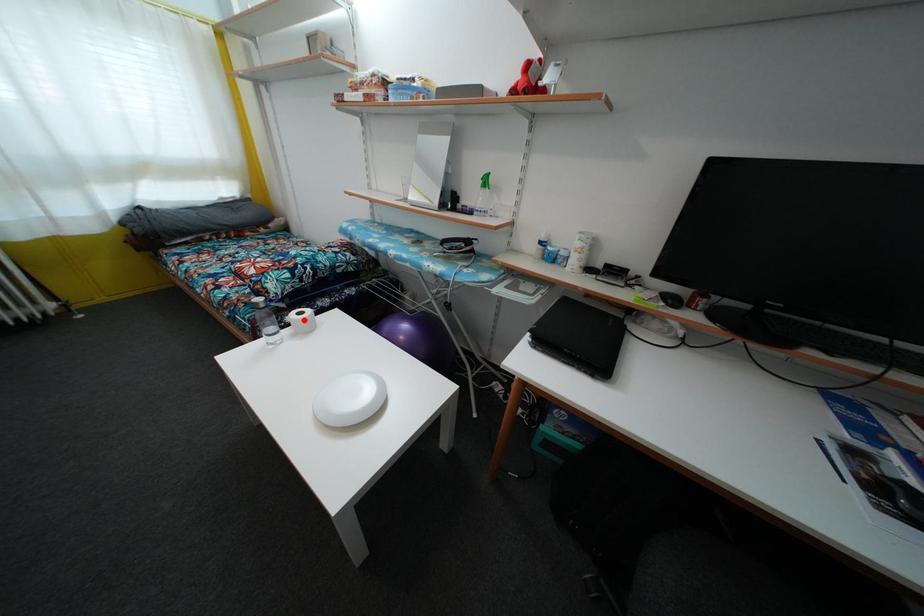
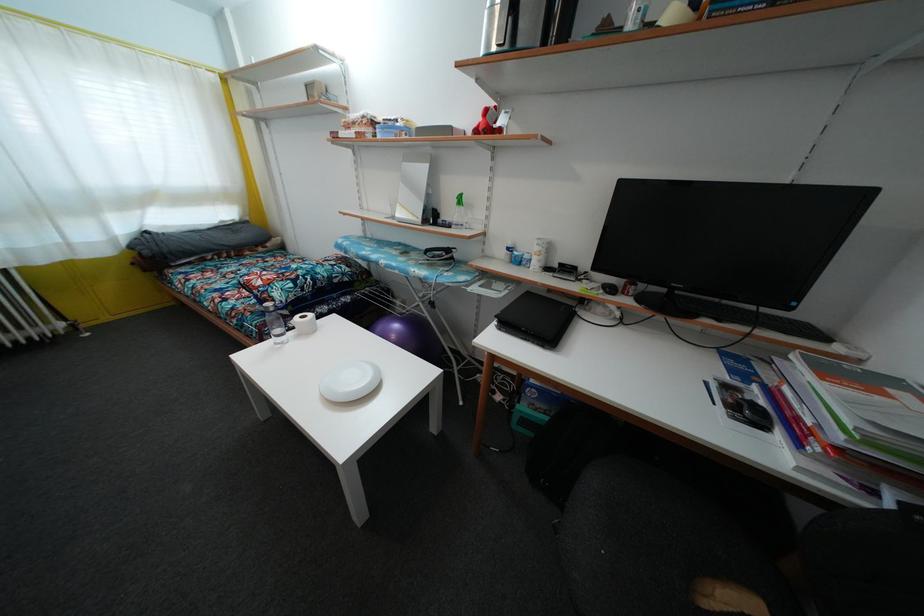
In the second image, find the point that corresponds to the highlighted location in the first image.

(307, 323)